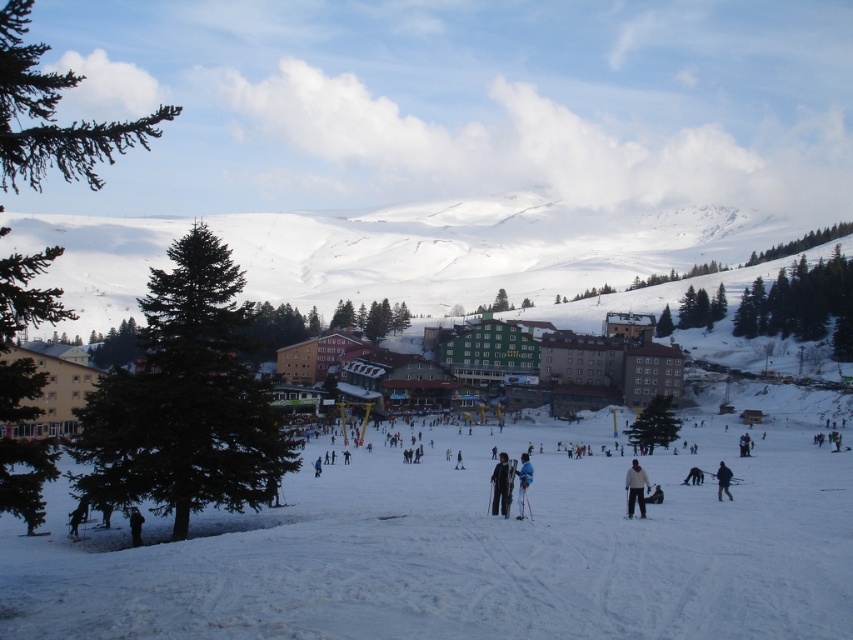
Question: Which of the following is the closest to the observer?

Choices:
 (A) black fabric person at lower left
 (B) white snow ski slope at lower left

Answer: (B)

Question: Which of these objects is positioned farthest from the dark blue jacket at center?

Choices:
 (A) white snow ski slope at lower left
 (B) black ski suit at center

Answer: (A)

Question: Which point is farther to the camera?

Choices:
 (A) black ski suit at center
 (B) black fabric person at lower left

Answer: (A)

Question: Is black ski suit at center wider than black fabric person at lower left?

Choices:
 (A) yes
 (B) no

Answer: (A)

Question: Where is black ski suit at center located in relation to white snow pants at center in the image?

Choices:
 (A) below
 (B) above

Answer: (A)

Question: Is white matte jacket at lower center to the left of dark blue jacket at center from the viewer's perspective?

Choices:
 (A) no
 (B) yes

Answer: (B)